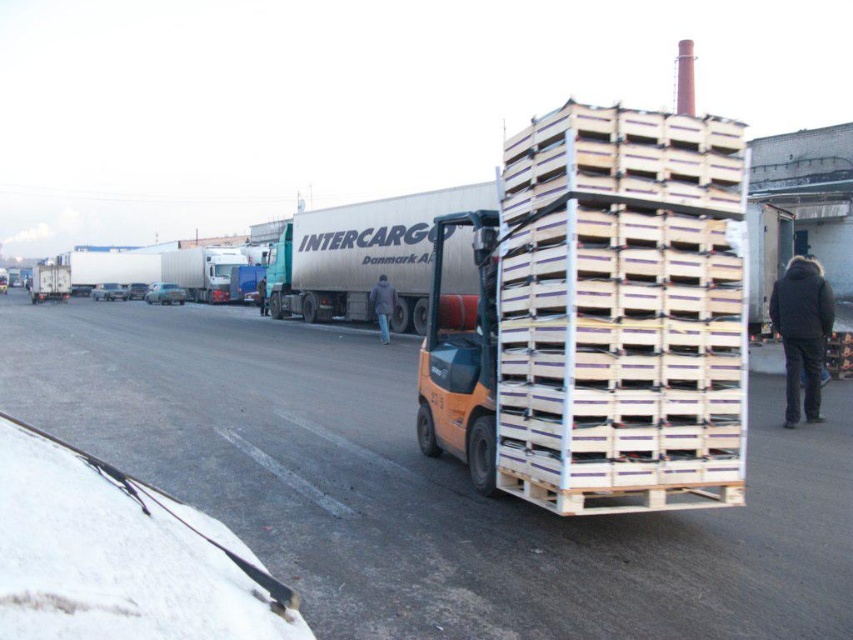
Is the position of silver metallic trailer truck at center more distant than that of dark gray fabric jacket at center?

No, silver metallic trailer truck at center is in front of dark gray fabric jacket at center.

You are a GUI agent. You are given a task and a screenshot of the screen. Output one action in this format:
    pyautogui.click(x=<x>, y=<y>)
    Task: Click on the silver metallic trailer truck at center
    Image resolution: width=853 pixels, height=640 pixels.
    Given the screenshot: What is the action you would take?
    pyautogui.click(x=363, y=256)

What do you see at coordinates (363, 256) in the screenshot? I see `silver metallic trailer truck at center` at bounding box center [363, 256].

Locate an element on the screen. This screenshot has height=640, width=853. silver metallic trailer truck at center is located at coordinates (363, 256).